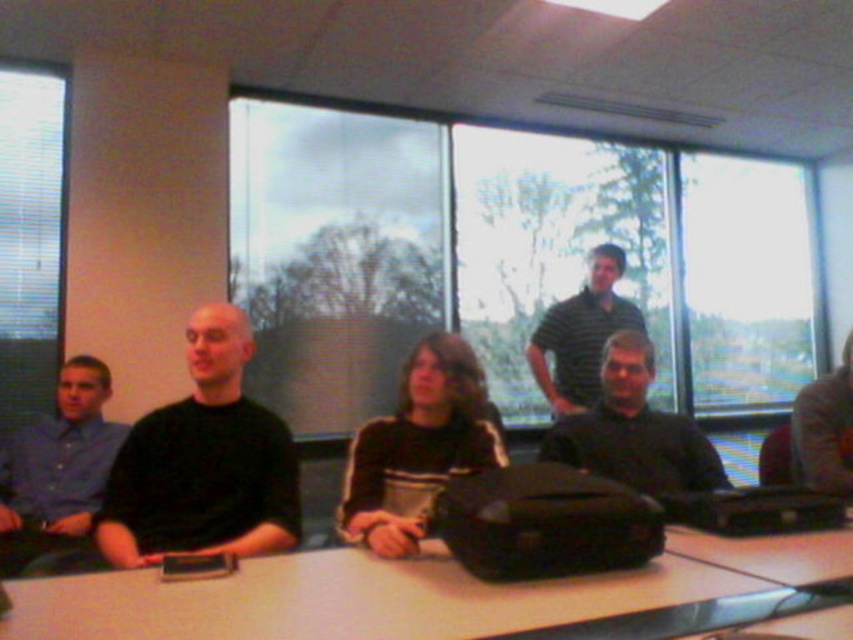
Can you confirm if black matte shirt at left is wider than striped cotton shirt at center?

No.

Does point (213, 410) lie in front of point (564, 330)?

Yes.

Where is `black matte shirt at left`? The width and height of the screenshot is (853, 640). black matte shirt at left is located at coordinates (204, 461).

What do you see at coordinates (346, 600) in the screenshot? I see `white matte table at center` at bounding box center [346, 600].

In order to click on white matte table at center in this screenshot , I will do `click(346, 600)`.

Does black matte shirt at left have a lesser width compared to dark brown leather jacket at right?

No, black matte shirt at left is not thinner than dark brown leather jacket at right.

Does black matte shirt at left come behind dark brown leather jacket at right?

No.

Which is in front, point (224, 328) or point (846, 428)?

Positioned in front is point (224, 328).

Identify the location of black matte shirt at left. (204, 461).